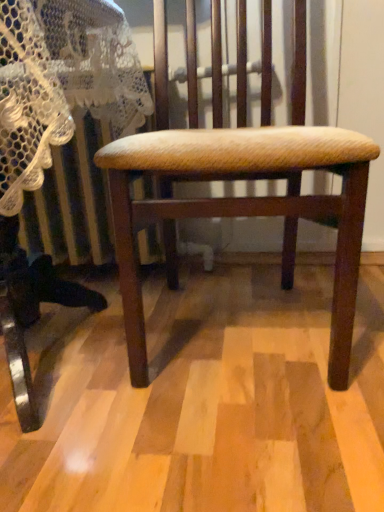
What do you see at coordinates (237, 179) in the screenshot?
I see `wooden chair at center` at bounding box center [237, 179].

Locate an element on the screen. This screenshot has width=384, height=512. wooden chair at center is located at coordinates (237, 179).

Image resolution: width=384 pixels, height=512 pixels. What do you see at coordinates (30, 310) in the screenshot?
I see `wooden textured stool at center` at bounding box center [30, 310].

Find the location of a particular element. Image resolution: width=384 pixels, height=512 pixels. wooden textured stool at center is located at coordinates (30, 310).

Measure the distance between wooden textured stool at center and camera.

The depth of wooden textured stool at center is 47.00 centimeters.

Locate an element on the screen. This screenshot has height=512, width=384. wooden chair at center is located at coordinates (237, 179).

Which is more to the right, wooden chair at center or wooden textured stool at center?

wooden chair at center is more to the right.

Considering the positions of objects wooden chair at center and wooden textured stool at center in the image provided, who is in front, wooden chair at center or wooden textured stool at center?

wooden textured stool at center is in front.

Considering the points (285, 240) and (50, 290), which point is behind, point (285, 240) or point (50, 290)?

Point (285, 240)

From the image's perspective, between wooden chair at center and wooden textured stool at center, who is located below?

wooden textured stool at center appears lower in the image.

From a real-world perspective, which object stands above the other?

wooden chair at center.

Does wooden chair at center have a lesser width compared to wooden textured stool at center?

Correct, the width of wooden chair at center is less than that of wooden textured stool at center.

Considering the sizes of wooden chair at center and wooden textured stool at center in the image, is wooden chair at center taller or shorter than wooden textured stool at center?

Clearly, wooden chair at center is taller compared to wooden textured stool at center.

Consider the image. Who is smaller, wooden chair at center or wooden textured stool at center?

Smaller between the two is wooden chair at center.

Is wooden chair at center situated inside wooden textured stool at center or outside?

wooden chair at center is not enclosed by wooden textured stool at center.

Are wooden chair at center and wooden textured stool at center beside each other?

wooden chair at center is not next to wooden textured stool at center, and they're not touching.

Is wooden chair at center facing towards wooden textured stool at center?

No.

How many degrees apart are the facing directions of wooden chair at center and wooden textured stool at center?

The facing directions of wooden chair at center and wooden textured stool at center are 3.4 degrees apart.

This screenshot has width=384, height=512. I want to click on rocking chair in front of the wooden chair at center, so click(x=30, y=310).

Considering the relative positions of wooden textured stool at center and wooden chair at center in the image provided, is wooden textured stool at center to the left or to the right of wooden chair at center?

In the image, wooden textured stool at center appears on the left side of wooden chair at center.

Does wooden textured stool at center come behind wooden chair at center?

No.

Is point (11, 53) closer or farther from the camera than point (166, 156)?

Point (11, 53).

From the image's perspective, is wooden textured stool at center under wooden chair at center?

Correct, wooden textured stool at center appears lower than wooden chair at center in the image.

From a real-world perspective, is wooden textured stool at center located beneath wooden chair at center?

Correct, in the physical world, wooden textured stool at center is lower than wooden chair at center.

Which object is wider, wooden textured stool at center or wooden chair at center?

With larger width is wooden textured stool at center.

Which of these two, wooden textured stool at center or wooden chair at center, stands taller?

Standing taller between the two is wooden chair at center.

Considering the sizes of objects wooden textured stool at center and wooden chair at center in the image provided, who is smaller, wooden textured stool at center or wooden chair at center?

wooden chair at center is smaller.

Is wooden textured stool at center not within wooden chair at center?

Yes.

Can you see wooden textured stool at center touching wooden chair at center?

No, wooden textured stool at center is not in contact with wooden chair at center.

Is wooden textured stool at center aimed at wooden chair at center?

No, wooden textured stool at center is not turned towards wooden chair at center.

Find the location of a particular element. rocking chair on the left of wooden chair at center is located at coordinates (30, 310).

Where is `chair above the wooden textured stool at center (from a real-world perspective)`? The width and height of the screenshot is (384, 512). chair above the wooden textured stool at center (from a real-world perspective) is located at coordinates (237, 179).

Locate an element on the screen. chair that appears behind the wooden textured stool at center is located at coordinates (237, 179).